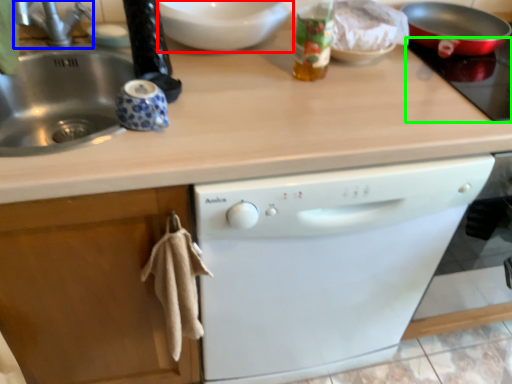
Question: Which is farther away from mixing bowl (highlighted by a red box)? faucet (highlighted by a blue box) or gas stove (highlighted by a green box)?

Choices:
 (A) faucet
 (B) gas stove

Answer: (B)